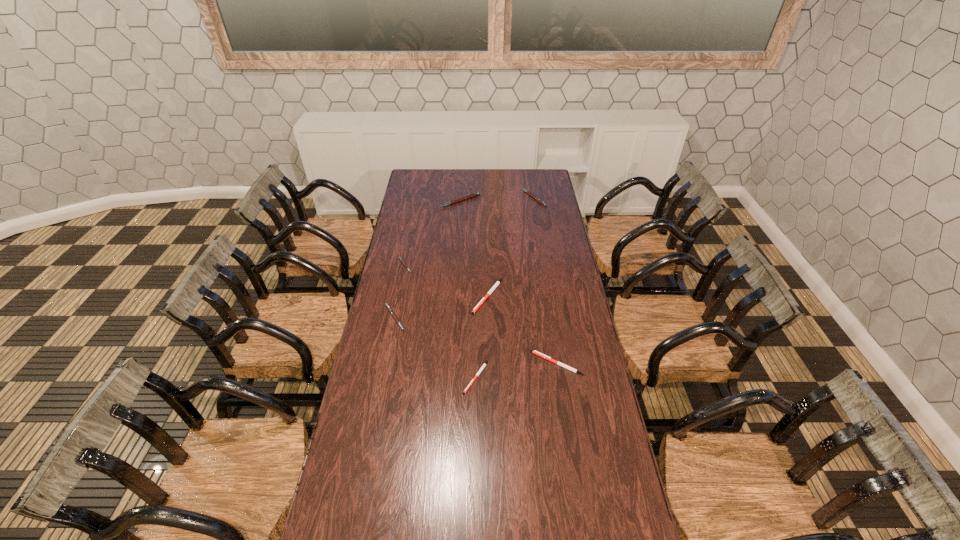
I want to click on free spot between the tallest pen and the nearest pink pen, so click(x=427, y=260).

Find the location of a particular element. This screenshot has height=540, width=960. the sixth closest object to the biggest white pen is located at coordinates (540, 201).

You are a GUI agent. You are given a task and a screenshot of the screen. Output one action in this format:
    pyautogui.click(x=<x>, y=<y>)
    Task: Click on the object that stands as the third closest to the smallest pink pen
    Image resolution: width=960 pixels, height=540 pixels.
    Given the screenshot: What is the action you would take?
    pyautogui.click(x=475, y=194)

Point out which pen is positioned as the fifth nearest to the biggest white pen. Please provide its 2D coordinates. Your answer should be formatted as a tuple, i.e. [(x, y)], where the tuple contains the x and y coordinates of a point satisfying the conditions above.

[(475, 194)]

The height and width of the screenshot is (540, 960). Find the location of `pen object that ranks as the closest to the smallest white pen`. pen object that ranks as the closest to the smallest white pen is located at coordinates (533, 351).

Locate an element on the screen. Image resolution: width=960 pixels, height=540 pixels. pink pen that is the third closest to the biggest pink pen is located at coordinates [x=389, y=308].

Where is `the second closest pink pen to the farthest white pen`? This screenshot has width=960, height=540. the second closest pink pen to the farthest white pen is located at coordinates (400, 258).

This screenshot has height=540, width=960. Find the location of `the second closest white pen to the second smallest white pen`. the second closest white pen to the second smallest white pen is located at coordinates (497, 283).

Locate which white pen is the third closest to the second smallest pink pen. Please provide its 2D coordinates. Your answer should be formatted as a tuple, i.e. [(x, y)], where the tuple contains the x and y coordinates of a point satisfying the conditions above.

[(533, 351)]

In order to click on vacant space that satisfies the following two spatial constraints: 1. on the clicker of the second biggest white pen; 2. on the clicker of the smallest white pen in this screenshot , I will do `click(559, 377)`.